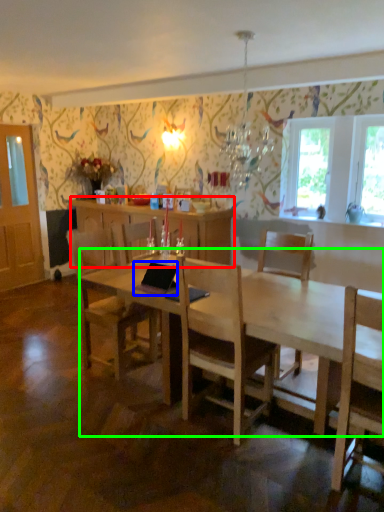
Question: Considering the real-world distances, which object is closest to cabinetry (highlighted by a red box)? laptop (highlighted by a blue box) or desk (highlighted by a green box).

Choices:
 (A) laptop
 (B) desk

Answer: (A)